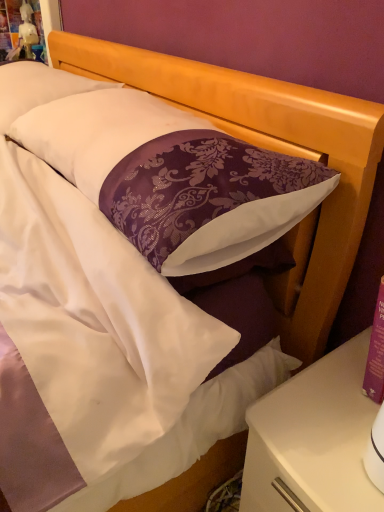
Question: From the image's perspective, is white satin pillow at upper left, positioned as the first pillow in back-to-front order, below white glossy nightstand at lower right?

Choices:
 (A) no
 (B) yes

Answer: (A)

Question: Is white satin pillow at upper left, positioned as the first pillow in back-to-front order, taller than white glossy nightstand at lower right?

Choices:
 (A) yes
 (B) no

Answer: (B)

Question: Can you confirm if white satin pillow at upper left, positioned as the first pillow in back-to-front order, is wider than white glossy nightstand at lower right?

Choices:
 (A) no
 (B) yes

Answer: (A)

Question: From the image's perspective, does white satin pillow at upper left, which appears as the second pillow when viewed from the front, appear higher than white glossy nightstand at lower right?

Choices:
 (A) yes
 (B) no

Answer: (A)

Question: Are white satin pillow at upper left, which appears as the second pillow when viewed from the front, and white glossy nightstand at lower right located far from each other?

Choices:
 (A) no
 (B) yes

Answer: (A)

Question: Is white glossy nightstand at lower right inside white satin pillow at upper left, positioned as the first pillow in back-to-front order?

Choices:
 (A) no
 (B) yes

Answer: (A)

Question: Is white satin pillow at upper left, which appears as the second pillow when viewed from the front, a part of purple damask pillow at center, the first pillow positioned from the front?

Choices:
 (A) yes
 (B) no

Answer: (B)

Question: Is purple damask pillow at center, the first pillow positioned from the front, positioned with its back to white satin pillow at upper left, which appears as the second pillow when viewed from the front?

Choices:
 (A) no
 (B) yes

Answer: (A)

Question: Does purple damask pillow at center, arranged as the 2th pillow when viewed from the back, have a lesser height compared to white satin pillow at upper left, which appears as the second pillow when viewed from the front?

Choices:
 (A) no
 (B) yes

Answer: (B)

Question: Considering the relative positions of purple damask pillow at center, arranged as the 2th pillow when viewed from the back, and white satin pillow at upper left, positioned as the first pillow in back-to-front order, in the image provided, is purple damask pillow at center, arranged as the 2th pillow when viewed from the back, to the left of white satin pillow at upper left, positioned as the first pillow in back-to-front order, from the viewer's perspective?

Choices:
 (A) yes
 (B) no

Answer: (B)

Question: Is purple damask pillow at center, the first pillow positioned from the front, taller than white satin pillow at upper left, which appears as the second pillow when viewed from the front?

Choices:
 (A) no
 (B) yes

Answer: (A)

Question: From a real-world perspective, is purple damask pillow at center, the first pillow positioned from the front, on white satin pillow at upper left, which appears as the second pillow when viewed from the front?

Choices:
 (A) yes
 (B) no

Answer: (A)

Question: Is purple damask pillow at center, arranged as the 2th pillow when viewed from the back, outside of white glossy nightstand at lower right?

Choices:
 (A) yes
 (B) no

Answer: (A)